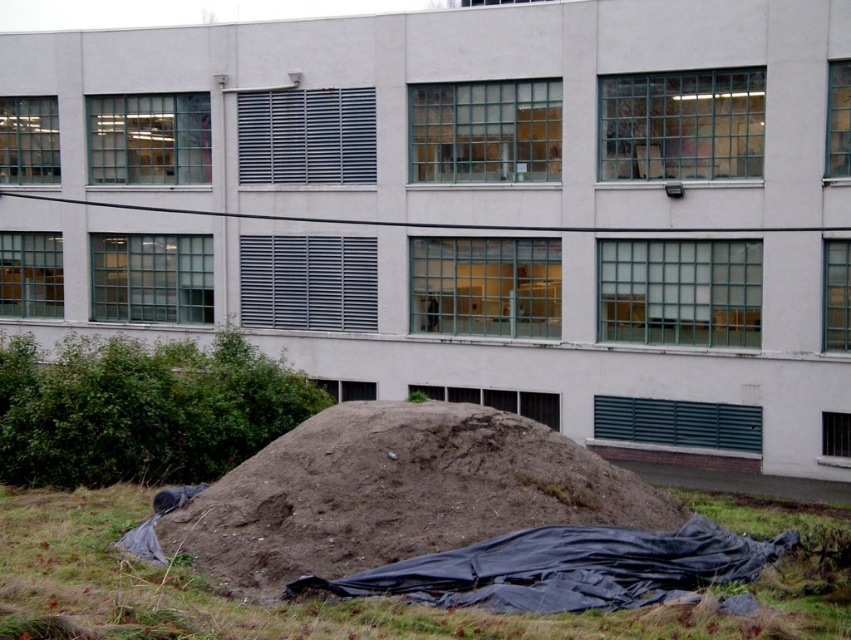
Between brown dirt mound at lower center and brown grass at lower center, which one is positioned higher?

brown dirt mound at lower center

Can you confirm if brown dirt mound at lower center is positioned below brown grass at lower center?

Actually, brown dirt mound at lower center is above brown grass at lower center.

Where is `brown dirt mound at lower center`? The height and width of the screenshot is (640, 851). brown dirt mound at lower center is located at coordinates (397, 492).